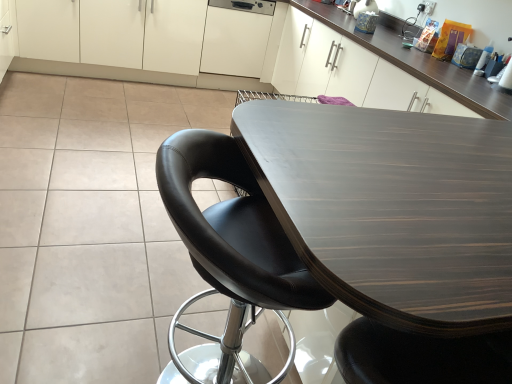
Find the location of a particular element. Image resolution: width=512 pixels, height=384 pixels. white glossy cabinets at upper center, the second cabinetry in the right-to-left sequence is located at coordinates (137, 42).

The height and width of the screenshot is (384, 512). Describe the element at coordinates (229, 259) in the screenshot. I see `black leather chair at center` at that location.

The height and width of the screenshot is (384, 512). Describe the element at coordinates (236, 37) in the screenshot. I see `white matte cabinet at center, the 1th cabinetry when ordered from right to left` at that location.

At what (x,y) coordinates should I click in order to perform the action: click on white glossy cabinets at upper center, which is the first cabinetry in left-to-right order. Please return your answer as a coordinate pair (x, y). Image resolution: width=512 pixels, height=384 pixels. Looking at the image, I should click on (137, 42).

Which object is more forward, black leather chair at center or dark wood table at center?

dark wood table at center is in front.

Is black leather chair at center smaller than dark wood table at center?

Indeed, black leather chair at center has a smaller size compared to dark wood table at center.

From a real-world perspective, which object stands above the other?

black leather chair at center.

What are the coordinates of `chair above the dark wood table at center (from a real-world perspective)` in the screenshot? It's located at (229, 259).

From the image's perspective, which is below, dark wood table at center or black leather chair at center?

dark wood table at center, from the image's perspective.

Could you tell me if dark wood table at center is turned towards black leather chair at center?

No, dark wood table at center is not oriented towards black leather chair at center.

Can you confirm if dark wood table at center is taller than black leather chair at center?

Incorrect, the height of dark wood table at center is not larger of that of black leather chair at center.

From a real-world perspective, between dark wood table at center and black leather chair at center, who is vertically lower?

dark wood table at center, from a real-world perspective.

From the image's perspective, between white glossy cabinets at upper center, the second cabinetry in the right-to-left sequence, and dark wood table at center, which one is located above?

white glossy cabinets at upper center, the second cabinetry in the right-to-left sequence, is shown above in the image.

Is white glossy cabinets at upper center, which is the first cabinetry in left-to-right order, thinner than dark wood table at center?

Yes, white glossy cabinets at upper center, which is the first cabinetry in left-to-right order, is thinner than dark wood table at center.

Can you confirm if white glossy cabinets at upper center, which is the first cabinetry in left-to-right order, is shorter than dark wood table at center?

Yes.

Does white matte cabinet at center, the 1th cabinetry when ordered from right to left, turn towards dark wood table at center?

Yes.

Is white matte cabinet at center, which is counted as the second cabinetry, starting from the left, spatially inside dark wood table at center, or outside of it?

white matte cabinet at center, which is counted as the second cabinetry, starting from the left, is not inside dark wood table at center, it's outside.

From the image's perspective, is white matte cabinet at center, which is counted as the second cabinetry, starting from the left, over dark wood table at center?

Correct, white matte cabinet at center, which is counted as the second cabinetry, starting from the left, appears higher than dark wood table at center in the image.

Which is closer to the camera, (x=243, y=8) or (x=482, y=251)?

Point (x=243, y=8) appears to be farther away from the viewer than point (x=482, y=251).

Considering the sizes of objects black leather chair at center and white matte cabinet at center, the 1th cabinetry when ordered from right to left, in the image provided, who is shorter, black leather chair at center or white matte cabinet at center, the 1th cabinetry when ordered from right to left,?

white matte cabinet at center, the 1th cabinetry when ordered from right to left, is shorter.

Is point (270, 250) farther from viewer compared to point (225, 52)?

No, it is in front of (225, 52).

Could you tell me if black leather chair at center is facing white matte cabinet at center, the 1th cabinetry when ordered from right to left?

No, black leather chair at center is not oriented towards white matte cabinet at center, the 1th cabinetry when ordered from right to left.

Is the surface of black leather chair at center in direct contact with white matte cabinet at center, the 1th cabinetry when ordered from right to left?

black leather chair at center and white matte cabinet at center, the 1th cabinetry when ordered from right to left, are clearly separated.

Who is bigger, white matte cabinet at center, which is counted as the second cabinetry, starting from the left, or black leather chair at center?

With larger size is black leather chair at center.

Is black leather chair at center at the back of white matte cabinet at center, the 1th cabinetry when ordered from right to left?

No.

Is white matte cabinet at center, which is counted as the second cabinetry, starting from the left, with black leather chair at center?

They are not placed beside each other.

Between point (181, 83) and point (267, 21), which one is positioned in front?

The point (267, 21) is in front.

In terms of height, does white glossy cabinets at upper center, the second cabinetry in the right-to-left sequence, look taller or shorter compared to white matte cabinet at center, the 1th cabinetry when ordered from right to left?

Considering their sizes, white glossy cabinets at upper center, the second cabinetry in the right-to-left sequence, has more height than white matte cabinet at center, the 1th cabinetry when ordered from right to left.

Is white glossy cabinets at upper center, the second cabinetry in the right-to-left sequence, placed right next to white matte cabinet at center, which is counted as the second cabinetry, starting from the left?

No, white glossy cabinets at upper center, the second cabinetry in the right-to-left sequence, is not in contact with white matte cabinet at center, which is counted as the second cabinetry, starting from the left.

Is the position of white glossy cabinets at upper center, the second cabinetry in the right-to-left sequence, less distant than that of white matte cabinet at center, the 1th cabinetry when ordered from right to left?

Yes, white glossy cabinets at upper center, the second cabinetry in the right-to-left sequence, is in front of white matte cabinet at center, the 1th cabinetry when ordered from right to left.

Locate an element on the screen. The image size is (512, 384). table on the right of black leather chair at center is located at coordinates tap(396, 231).

I want to click on chair above the dark wood table at center (from the image's perspective), so click(x=229, y=259).

Which object lies nearer to the anchor point dark wood table at center, black leather chair at center or white matte cabinet at center, which is counted as the second cabinetry, starting from the left?

black leather chair at center.

Estimate the real-world distances between objects in this image. Which object is closer to dark wood table at center, white glossy cabinets at upper center, which is the first cabinetry in left-to-right order, or white matte cabinet at center, which is counted as the second cabinetry, starting from the left?

Based on the image, white matte cabinet at center, which is counted as the second cabinetry, starting from the left, appears to be nearer to dark wood table at center.

When comparing their distances from white matte cabinet at center, the 1th cabinetry when ordered from right to left, does white glossy cabinets at upper center, the second cabinetry in the right-to-left sequence, or dark wood table at center seem further?

dark wood table at center.

When comparing their distances from white glossy cabinets at upper center, the second cabinetry in the right-to-left sequence, does dark wood table at center or black leather chair at center seem further?

dark wood table at center.

Considering their positions, is white glossy cabinets at upper center, which is the first cabinetry in left-to-right order, positioned closer to black leather chair at center than dark wood table at center?

Among the two, dark wood table at center is located nearer to black leather chair at center.

When comparing their distances from black leather chair at center, does white matte cabinet at center, which is counted as the second cabinetry, starting from the left, or dark wood table at center seem further?

The object further to black leather chair at center is white matte cabinet at center, which is counted as the second cabinetry, starting from the left.

When comparing their distances from black leather chair at center, does white glossy cabinets at upper center, the second cabinetry in the right-to-left sequence, or white matte cabinet at center, which is counted as the second cabinetry, starting from the left, seem closer?

white glossy cabinets at upper center, the second cabinetry in the right-to-left sequence, is positioned closer to the anchor black leather chair at center.

Based on the photo, looking at the image, which one is located further to white glossy cabinets at upper center, the second cabinetry in the right-to-left sequence, white matte cabinet at center, which is counted as the second cabinetry, starting from the left, or black leather chair at center?

black leather chair at center is positioned further to the anchor white glossy cabinets at upper center, the second cabinetry in the right-to-left sequence.

This screenshot has height=384, width=512. I want to click on cabinetry between dark wood table at center and white matte cabinet at center, the 1th cabinetry when ordered from right to left, along the z-axis, so click(x=137, y=42).

Where is `cabinetry between black leather chair at center and white matte cabinet at center, which is counted as the second cabinetry, starting from the left, from front to back`? The height and width of the screenshot is (384, 512). cabinetry between black leather chair at center and white matte cabinet at center, which is counted as the second cabinetry, starting from the left, from front to back is located at coordinates (137, 42).

The image size is (512, 384). I want to click on chair positioned between dark wood table at center and white matte cabinet at center, which is counted as the second cabinetry, starting from the left, from near to far, so click(x=229, y=259).

This screenshot has height=384, width=512. Identify the location of chair between dark wood table at center and white glossy cabinets at upper center, which is the first cabinetry in left-to-right order, from front to back. (229, 259).